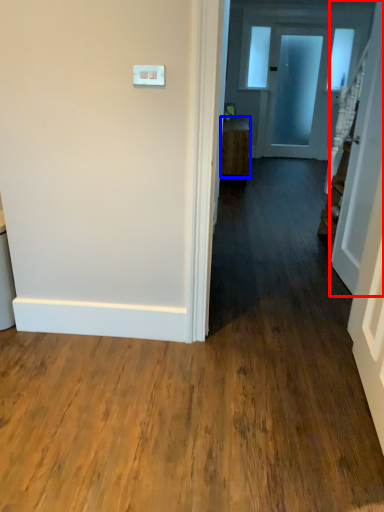
Question: Which point is further to the camera, door (highlighted by a red box) or furniture (highlighted by a blue box)?

Choices:
 (A) door
 (B) furniture

Answer: (B)